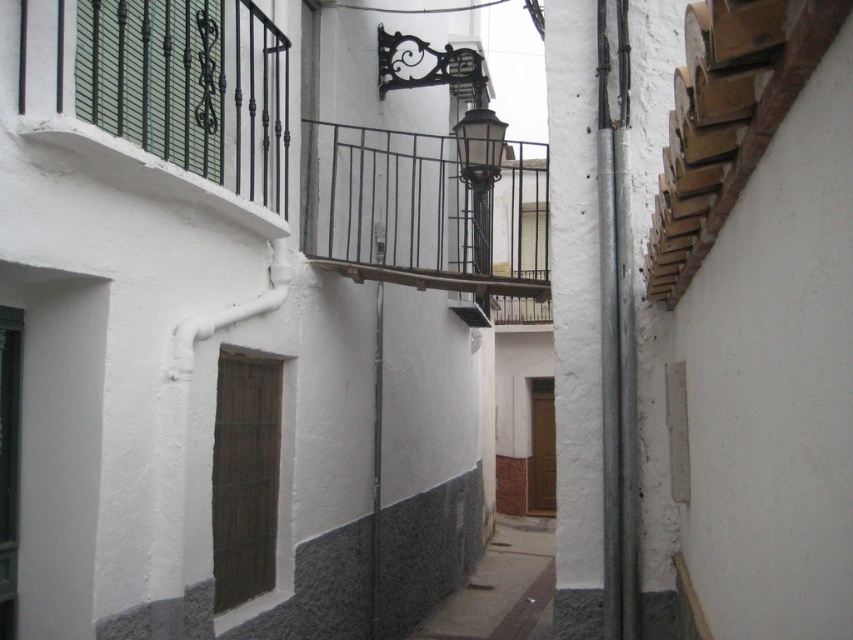
Question: Which point appears farthest from the camera in this image?

Choices:
 (A) (260, 163)
 (B) (672, 211)
 (C) (540, 298)

Answer: (C)

Question: Which of these objects is positioned farthest from the black wrought iron balcony at upper left?

Choices:
 (A) black wrought iron balcony at upper center
 (B) brown wooden tiles at upper right

Answer: (A)

Question: Does black wrought iron balcony at upper left appear over brown wooden tiles at upper right?

Choices:
 (A) no
 (B) yes

Answer: (B)

Question: Which object is closer to the camera taking this photo?

Choices:
 (A) black wrought iron balcony at upper left
 (B) brown wooden tiles at upper right
 (C) black wrought iron balcony at upper center

Answer: (B)

Question: Can you confirm if black wrought iron balcony at upper left is positioned to the right of brown wooden tiles at upper right?

Choices:
 (A) no
 (B) yes

Answer: (A)

Question: From the image, what is the correct spatial relationship of black wrought iron balcony at upper center in relation to brown wooden tiles at upper right?

Choices:
 (A) below
 (B) above

Answer: (B)